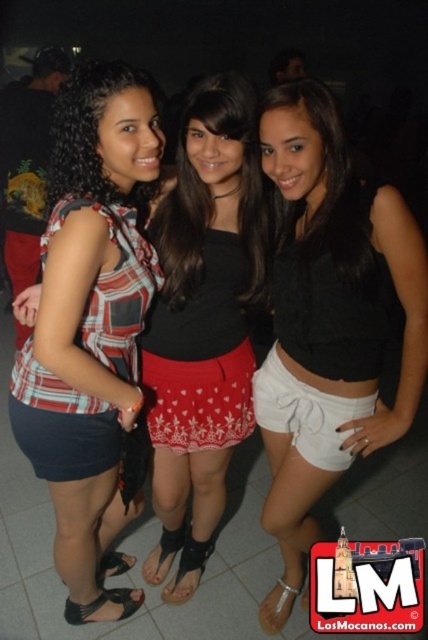
Is plaid fabric top at center smaller than red printed skirt at center?

Actually, plaid fabric top at center might be larger than red printed skirt at center.

In the scene shown: Which is below, plaid fabric top at center or red printed skirt at center?

plaid fabric top at center is lower down.

Does point (77, 401) come closer to viewer compared to point (264, 266)?

Yes, point (77, 401) is closer to viewer.

This screenshot has height=640, width=428. What are the coordinates of `plaid fabric top at center` in the screenshot? It's located at (89, 323).

Can you confirm if black matte shorts at center is positioned to the right of plaid fabric top at center?

Correct, you'll find black matte shorts at center to the right of plaid fabric top at center.

Between point (359, 272) and point (94, 456), which one is positioned in front?

Positioned in front is point (359, 272).

Who is more distant from viewer, (x=323, y=410) or (x=55, y=141)?

The point (x=55, y=141) is behind.

At what (x,y) coordinates should I click in order to perform the action: click on black matte shorts at center. Please return your answer as a coordinate pair (x, y). Looking at the image, I should click on (329, 321).

Is black matte shorts at center further to the viewer compared to red printed skirt at center?

No, it is in front of red printed skirt at center.

Can you confirm if black matte shorts at center is positioned to the left of red printed skirt at center?

In fact, black matte shorts at center is to the right of red printed skirt at center.

Is point (309, 148) behind point (228, 376)?

No, it is not.

You are a GUI agent. You are given a task and a screenshot of the screen. Output one action in this format:
    pyautogui.click(x=<x>, y=<y>)
    Task: Click on the black matte shorts at center
    
    Given the screenshot: What is the action you would take?
    pyautogui.click(x=329, y=321)